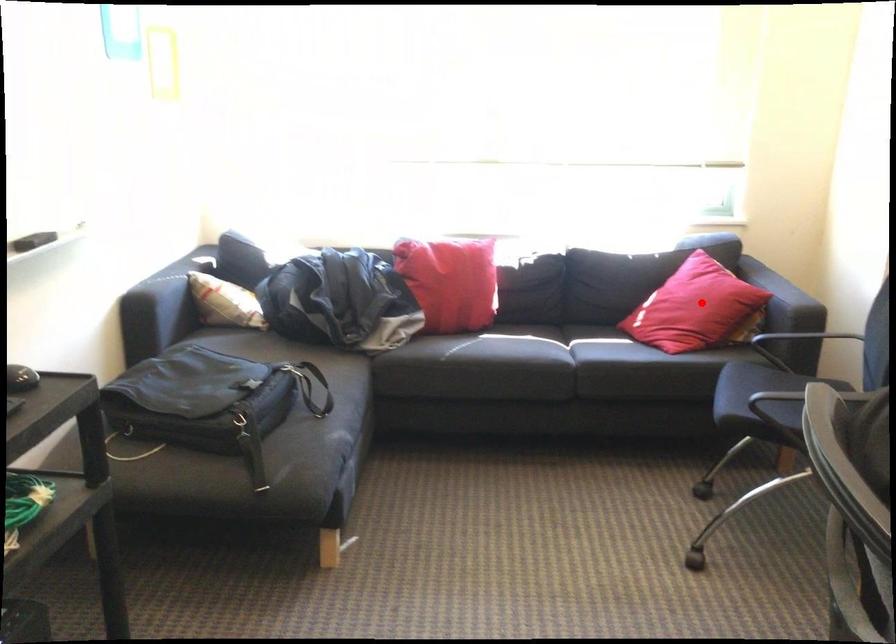
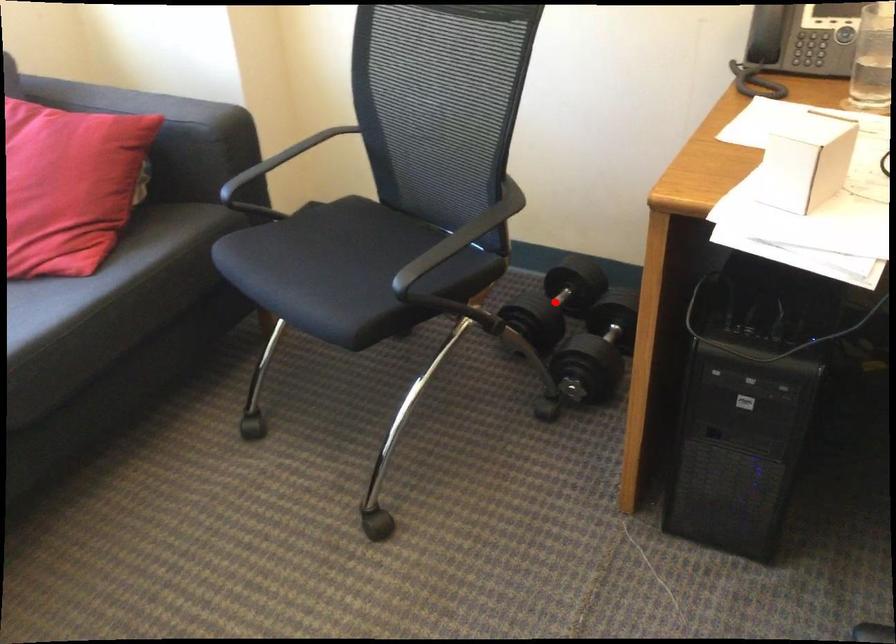
I am providing you with two images of the same scene from different viewpoints. A red point is marked on the first image and another point is marked on the second image. Is the marked point in image1 the same physical position as the marked point in image2?

No